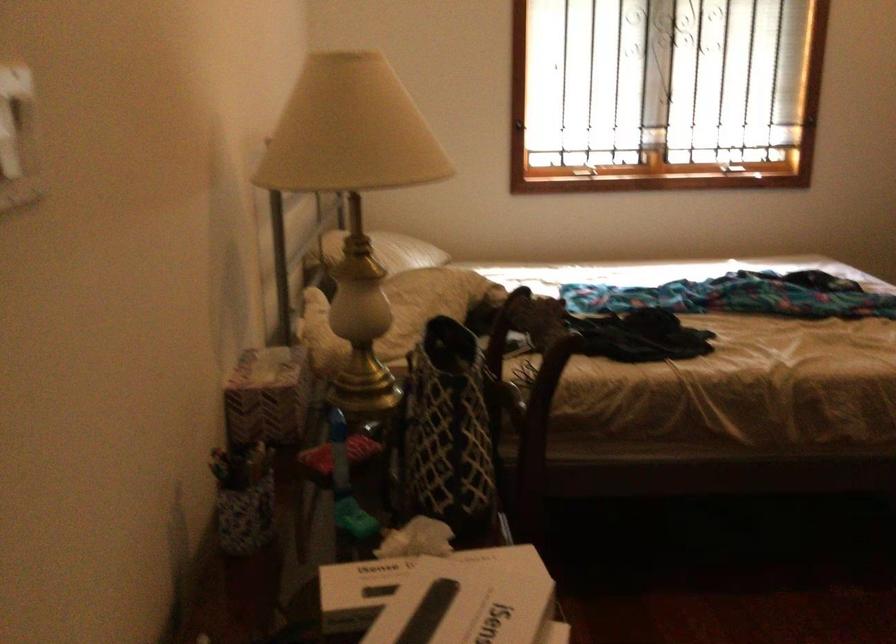
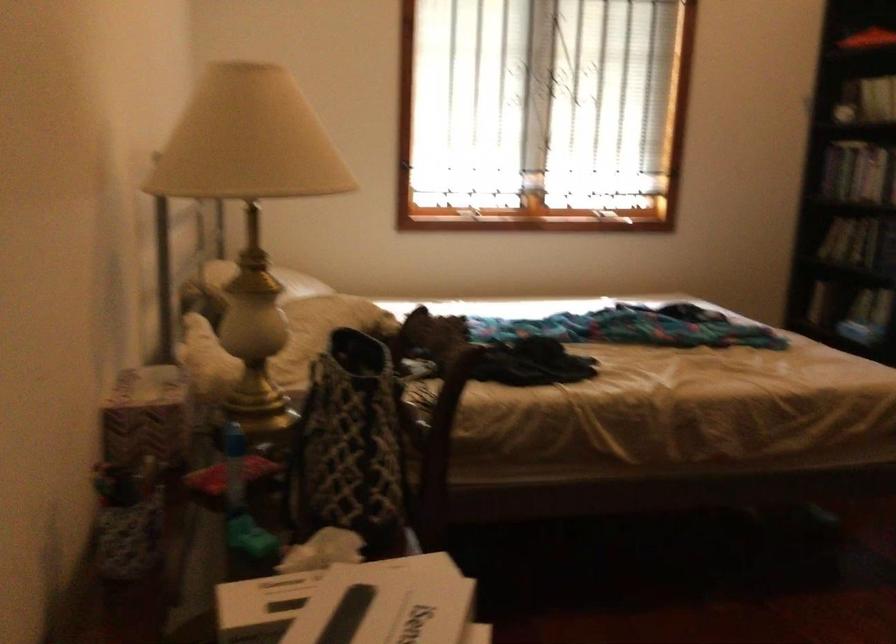
Question: Based on the continuous images, in which direction is the camera rotating? Reply with the corresponding letter.

Choices:
 (A) Left
 (B) Right
 (C) Up
 (D) Down

Answer: (B)